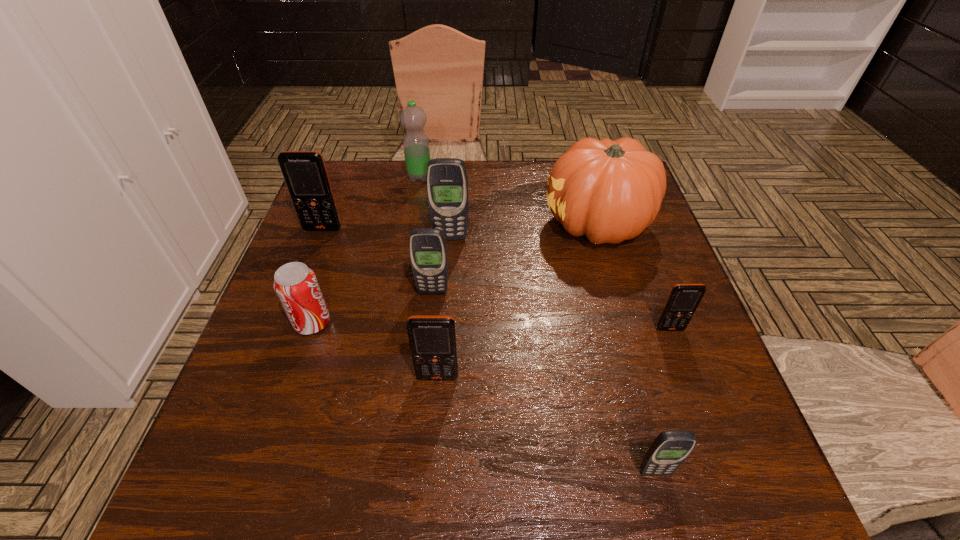
Locate an element on the screen. blank region between the soda can and the second smallest gray cellular telephone is located at coordinates (372, 307).

Locate an element on the screen. The height and width of the screenshot is (540, 960). free spot between the farthest orange cellular telephone and the red soda can is located at coordinates (318, 276).

You are a GUI agent. You are given a task and a screenshot of the screen. Output one action in this format:
    pyautogui.click(x=<x>, y=<y>)
    Task: Click on the free space that is in between the pumpkin and the farthest gray cellular telephone
    Image resolution: width=960 pixels, height=540 pixels.
    Given the screenshot: What is the action you would take?
    pyautogui.click(x=524, y=231)

This screenshot has width=960, height=540. I want to click on free space that is in between the second biggest orange cellular telephone and the rightmost gray cellular telephone, so click(x=546, y=424).

At what (x,y) coordinates should I click in order to perform the action: click on free space between the red soda can and the fifth nearest cellular telephone. Please return your answer as a coordinate pair (x, y). Looking at the image, I should click on (381, 280).

At what (x,y) coordinates should I click in order to perform the action: click on free space between the farthest gray cellular telephone and the fourth farthest cellular telephone. Please return your answer as a coordinate pair (x, y). This screenshot has width=960, height=540. Looking at the image, I should click on (561, 283).

The width and height of the screenshot is (960, 540). In order to click on vacant area that lies between the biggest orange cellular telephone and the second biggest orange cellular telephone in this screenshot , I will do `click(380, 303)`.

The image size is (960, 540). In order to click on free area in between the smallest gray cellular telephone and the biggest gray cellular telephone in this screenshot , I will do `click(553, 355)`.

The height and width of the screenshot is (540, 960). I want to click on object that ranks as the third closest to the soda can, so click(x=305, y=174).

Find the location of `object that stands as the fourth closest to the second orange cellular telephone from left to right`. object that stands as the fourth closest to the second orange cellular telephone from left to right is located at coordinates coord(610,191).